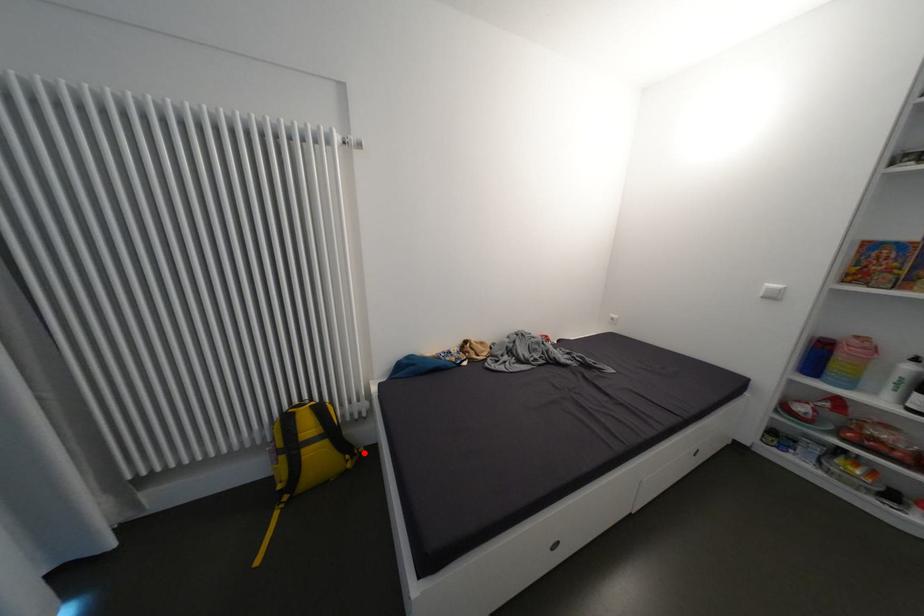
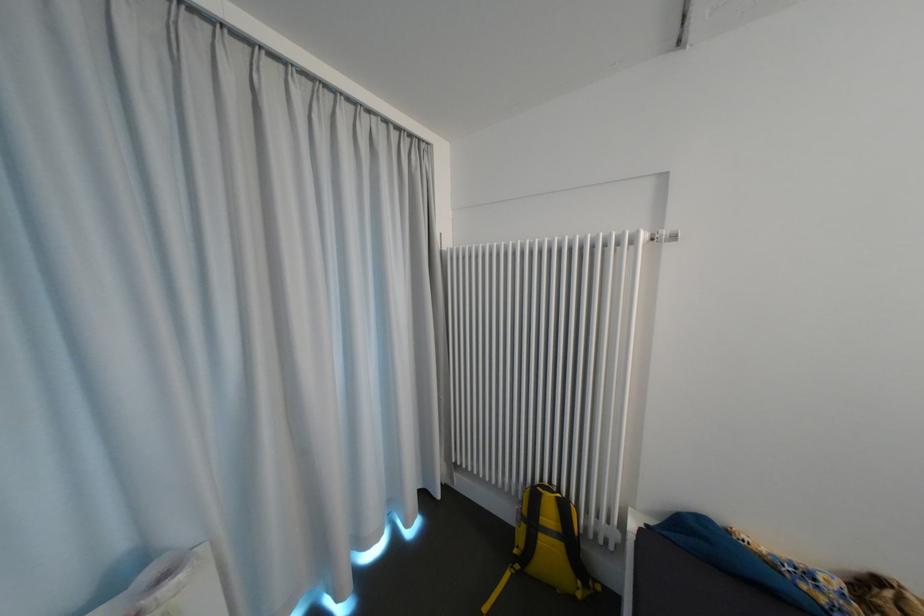
Where in the second image is the point corresponding to the highlighted location from the first image?

(599, 586)